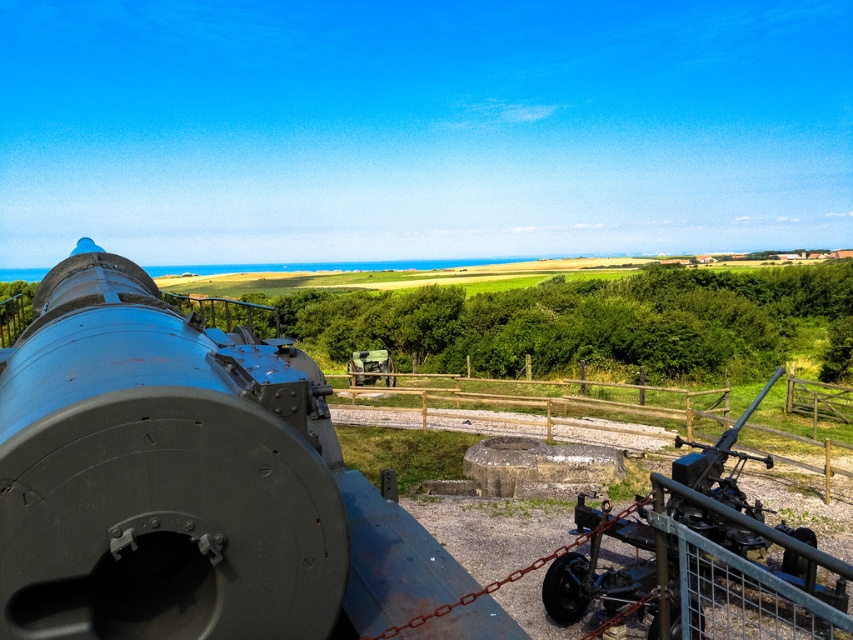
Question: Is matte black cannon at left closer to the viewer compared to matte black cannon at right?

Choices:
 (A) yes
 (B) no

Answer: (A)

Question: Is matte black cannon at left wider than matte black cannon at right?

Choices:
 (A) yes
 (B) no

Answer: (A)

Question: Which point is closer to the camera?

Choices:
 (A) matte black cannon at left
 (B) matte black cannon at right

Answer: (A)

Question: Can you confirm if matte black cannon at left is positioned to the right of matte black cannon at right?

Choices:
 (A) yes
 (B) no

Answer: (B)